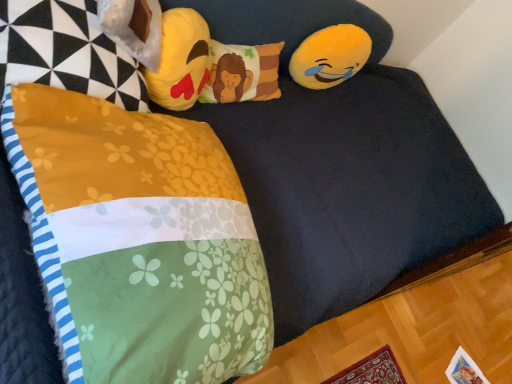
Locate an element on the screen. yellow plush emoji at upper right, which is the first toy in back-to-front order is located at coordinates 330,56.

This screenshot has width=512, height=384. What do you see at coordinates (209, 66) in the screenshot?
I see `soft yellow plush emoji at upper center, the second toy when ordered from back to front` at bounding box center [209, 66].

The height and width of the screenshot is (384, 512). I want to click on yellow plush emoji at upper right, which is the first toy in back-to-front order, so click(330, 56).

Does fluffy floral blanket at lower left, the 1th pillow when ordered from front to back, have a lesser width compared to yellow plush emoji at upper right, marked as the 2th toy in a left-to-right arrangement?

Incorrect, the width of fluffy floral blanket at lower left, the 1th pillow when ordered from front to back, is not less than that of yellow plush emoji at upper right, marked as the 2th toy in a left-to-right arrangement.

Is fluffy floral blanket at lower left, the second pillow when ordered from back to front, placed right next to yellow plush emoji at upper right, which is the 2th toy in front-to-back order?

No, fluffy floral blanket at lower left, the second pillow when ordered from back to front, is not next to yellow plush emoji at upper right, which is the 2th toy in front-to-back order.

Do you think fluffy floral blanket at lower left, the 1th pillow when ordered from front to back, is within yellow plush emoji at upper right, marked as the 2th toy in a left-to-right arrangement, or outside of it?

fluffy floral blanket at lower left, the 1th pillow when ordered from front to back, cannot be found inside yellow plush emoji at upper right, marked as the 2th toy in a left-to-right arrangement.

Which is less distant, (218, 234) or (332, 43)?

Positioned in front is point (218, 234).

Does soft yellow plush emoji at upper center, marked as the second toy in a right-to-left arrangement, turn towards fluffy floral blanket at lower left, marked as the second pillow in a top-to-bottom arrangement?

Yes, soft yellow plush emoji at upper center, marked as the second toy in a right-to-left arrangement, faces towards fluffy floral blanket at lower left, marked as the second pillow in a top-to-bottom arrangement.

Is soft yellow plush emoji at upper center, the first toy positioned from the left, beside fluffy floral blanket at lower left, the second pillow when ordered from back to front?

soft yellow plush emoji at upper center, the first toy positioned from the left, is not next to fluffy floral blanket at lower left, the second pillow when ordered from back to front, and they're not touching.

In the image, is soft yellow plush emoji at upper center, marked as the second toy in a right-to-left arrangement, on the left side or the right side of fluffy floral blanket at lower left, the 1th pillow when ordered from front to back?

soft yellow plush emoji at upper center, marked as the second toy in a right-to-left arrangement, is positioned on fluffy floral blanket at lower left, the 1th pillow when ordered from front to back,'s left side.

Does point (246, 95) come in front of point (125, 246)?

No, it is not.

In the image, is soft yellow plush emoji at upper center, the first toy positioned from the left, positioned in front of or behind yellow plush emoji at upper right, marked as the 2th toy in a left-to-right arrangement?

In the image, soft yellow plush emoji at upper center, the first toy positioned from the left, appears in front of yellow plush emoji at upper right, marked as the 2th toy in a left-to-right arrangement.

Is soft yellow plush emoji at upper center, the first toy positioned from the front, positioned beyond the bounds of yellow plush emoji at upper right, marked as the 2th toy in a left-to-right arrangement?

soft yellow plush emoji at upper center, the first toy positioned from the front, is positioned outside yellow plush emoji at upper right, marked as the 2th toy in a left-to-right arrangement.

Considering the positions of objects soft yellow plush emoji at upper center, marked as the second toy in a right-to-left arrangement, and yellow plush emoji at upper right, which is the 2th toy in front-to-back order, in the image provided, who is more to the right, soft yellow plush emoji at upper center, marked as the second toy in a right-to-left arrangement, or yellow plush emoji at upper right, which is the 2th toy in front-to-back order,?

yellow plush emoji at upper right, which is the 2th toy in front-to-back order, is more to the right.

From the image's perspective, is soft yellow plush emoji at upper center, the second toy when ordered from back to front, over yellow plush emoji at upper right, marked as the 2th toy in a left-to-right arrangement?

Actually, soft yellow plush emoji at upper center, the second toy when ordered from back to front, appears below yellow plush emoji at upper right, marked as the 2th toy in a left-to-right arrangement, in the image.

From the image's perspective, which is below, yellow plush emoji at upper right, which is the 2th toy in front-to-back order, or soft yellow plush emoji at upper center, marked as the second toy in a right-to-left arrangement?

soft yellow plush emoji at upper center, marked as the second toy in a right-to-left arrangement.

Considering the relative sizes of yellow plush emoji at upper right, the first toy positioned from the right, and soft yellow plush emoji at upper center, marked as the second toy in a right-to-left arrangement, in the image provided, is yellow plush emoji at upper right, the first toy positioned from the right, bigger than soft yellow plush emoji at upper center, marked as the second toy in a right-to-left arrangement,?

Incorrect, yellow plush emoji at upper right, the first toy positioned from the right, is not larger than soft yellow plush emoji at upper center, marked as the second toy in a right-to-left arrangement.

Is yellow plush emoji at upper right, which is the 2th toy in front-to-back order, next to soft yellow plush emoji at upper center, the first toy positioned from the front?

No, yellow plush emoji at upper right, which is the 2th toy in front-to-back order, is not next to soft yellow plush emoji at upper center, the first toy positioned from the front.

Where is `toy below the yellow plush emoji at upper right, marked as the 2th toy in a left-to-right arrangement (from the image's perspective)`? The width and height of the screenshot is (512, 384). toy below the yellow plush emoji at upper right, marked as the 2th toy in a left-to-right arrangement (from the image's perspective) is located at coordinates (209, 66).

Is fluffy floral blanket at lower left, which is counted as the 1th pillow, starting from the bottom, at the back of yellow plush emoji at upper right, which is the first toy in back-to-front order?

No, yellow plush emoji at upper right, which is the first toy in back-to-front order, is not facing away from fluffy floral blanket at lower left, which is counted as the 1th pillow, starting from the bottom.

From a real-world perspective, starting from the fluffy floral blanket at lower left, which is counted as the 1th pillow, starting from the bottom, which toy is the 2nd one below it? Please provide its 2D coordinates.

[(330, 56)]

Is yellow plush emoji at upper right, which is the first toy in back-to-front order, positioned behind fluffy floral blanket at lower left, the 1th pillow when ordered from front to back?

Yes, yellow plush emoji at upper right, which is the first toy in back-to-front order, is behind fluffy floral blanket at lower left, the 1th pillow when ordered from front to back.

Is floral fabric pillow at center, the 2th pillow ordered from the bottom, smaller than yellow plush emoji at upper right, which is the first toy in back-to-front order?

Actually, floral fabric pillow at center, the 2th pillow ordered from the bottom, might be larger than yellow plush emoji at upper right, which is the first toy in back-to-front order.

Measure the distance from floral fabric pillow at center, the 2th pillow ordered from the bottom, to yellow plush emoji at upper right, marked as the 2th toy in a left-to-right arrangement.

The distance of floral fabric pillow at center, the 2th pillow ordered from the bottom, from yellow plush emoji at upper right, marked as the 2th toy in a left-to-right arrangement, is 9.15 inches.

From the image's perspective, would you say floral fabric pillow at center, the 2th pillow ordered from the bottom, is positioned over yellow plush emoji at upper right, marked as the 2th toy in a left-to-right arrangement?

No, from the image's perspective, floral fabric pillow at center, the 2th pillow ordered from the bottom, is not above yellow plush emoji at upper right, marked as the 2th toy in a left-to-right arrangement.

Considering the positions of point (278, 43) and point (227, 92), is point (278, 43) closer or farther from the camera than point (227, 92)?

Point (278, 43) is farther from the camera than point (227, 92).

Looking at this image, between soft yellow plush emoji at upper center, the first toy positioned from the front, and floral fabric pillow at center, the 2th pillow ordered from the bottom, which one is positioned behind?

floral fabric pillow at center, the 2th pillow ordered from the bottom, is further from the camera.

Is soft yellow plush emoji at upper center, the second toy when ordered from back to front, far from floral fabric pillow at center, which ranks as the 1th pillow in top-to-bottom order?

soft yellow plush emoji at upper center, the second toy when ordered from back to front, is near floral fabric pillow at center, which ranks as the 1th pillow in top-to-bottom order, not far away.

Consider the image. From the image's perspective, is soft yellow plush emoji at upper center, the first toy positioned from the left, over floral fabric pillow at center, the 2th pillow ordered from the bottom?

No, from the image's perspective, soft yellow plush emoji at upper center, the first toy positioned from the left, is not above floral fabric pillow at center, the 2th pillow ordered from the bottom.

Where is `toy on the right of the fluffy floral blanket at lower left, marked as the second pillow in a top-to-bottom arrangement`? The height and width of the screenshot is (384, 512). toy on the right of the fluffy floral blanket at lower left, marked as the second pillow in a top-to-bottom arrangement is located at coordinates (330, 56).

Identify the location of pillow lying in front of the soft yellow plush emoji at upper center, the first toy positioned from the left. (139, 240).

When comparing their distances from soft yellow plush emoji at upper center, the first toy positioned from the front, does fluffy floral blanket at lower left, marked as the second pillow in a top-to-bottom arrangement, or floral fabric pillow at center, acting as the 2th pillow starting from the front, seem closer?

The object closer to soft yellow plush emoji at upper center, the first toy positioned from the front, is floral fabric pillow at center, acting as the 2th pillow starting from the front.

From the image, which object appears to be nearer to fluffy floral blanket at lower left, the 1th pillow when ordered from front to back, soft yellow plush emoji at upper center, the second toy when ordered from back to front, or yellow plush emoji at upper right, which is the first toy in back-to-front order?

Based on the image, soft yellow plush emoji at upper center, the second toy when ordered from back to front, appears to be nearer to fluffy floral blanket at lower left, the 1th pillow when ordered from front to back.

Based on their spatial positions, is yellow plush emoji at upper right, which is the first toy in back-to-front order, or fluffy floral blanket at lower left, the second pillow when ordered from back to front, closer to soft yellow plush emoji at upper center, the first toy positioned from the left?

yellow plush emoji at upper right, which is the first toy in back-to-front order, is positioned closer to the anchor soft yellow plush emoji at upper center, the first toy positioned from the left.

Considering their positions, is yellow plush emoji at upper right, which is the 2th toy in front-to-back order, positioned closer to floral fabric pillow at center, acting as the 2th pillow starting from the front, than soft yellow plush emoji at upper center, marked as the second toy in a right-to-left arrangement?

Among the two, soft yellow plush emoji at upper center, marked as the second toy in a right-to-left arrangement, is located nearer to floral fabric pillow at center, acting as the 2th pillow starting from the front.

Based on their spatial positions, is floral fabric pillow at center, the 2th pillow ordered from the bottom, or yellow plush emoji at upper right, which is the first toy in back-to-front order, closer to soft yellow plush emoji at upper center, marked as the second toy in a right-to-left arrangement?

Among the two, floral fabric pillow at center, the 2th pillow ordered from the bottom, is located nearer to soft yellow plush emoji at upper center, marked as the second toy in a right-to-left arrangement.

Looking at the image, which one is located closer to fluffy floral blanket at lower left, which is counted as the 1th pillow, starting from the bottom, yellow plush emoji at upper right, which is the first toy in back-to-front order, or floral fabric pillow at center, acting as the 2th pillow starting from the front?

floral fabric pillow at center, acting as the 2th pillow starting from the front, lies closer to fluffy floral blanket at lower left, which is counted as the 1th pillow, starting from the bottom, than the other object.

Estimate the real-world distances between objects in this image. Which object is further from floral fabric pillow at center, the 2th pillow ordered from the bottom, soft yellow plush emoji at upper center, marked as the second toy in a right-to-left arrangement, or yellow plush emoji at upper right, marked as the 2th toy in a left-to-right arrangement?

The object further to floral fabric pillow at center, the 2th pillow ordered from the bottom, is yellow plush emoji at upper right, marked as the 2th toy in a left-to-right arrangement.

Based on the photo, from the image, which object appears to be nearer to fluffy floral blanket at lower left, which is counted as the 1th pillow, starting from the bottom, soft yellow plush emoji at upper center, marked as the second toy in a right-to-left arrangement, or floral fabric pillow at center, the 2th pillow ordered from the bottom?

Among the two, soft yellow plush emoji at upper center, marked as the second toy in a right-to-left arrangement, is located nearer to fluffy floral blanket at lower left, which is counted as the 1th pillow, starting from the bottom.

Find the location of a particular element. The height and width of the screenshot is (384, 512). pillow between fluffy floral blanket at lower left, the 1th pillow when ordered from front to back, and yellow plush emoji at upper right, the first toy positioned from the right, along the z-axis is located at coordinates (242, 73).

Where is `toy positioned between fluffy floral blanket at lower left, the second pillow when ordered from back to front, and yellow plush emoji at upper right, which is the 2th toy in front-to-back order, from near to far`? toy positioned between fluffy floral blanket at lower left, the second pillow when ordered from back to front, and yellow plush emoji at upper right, which is the 2th toy in front-to-back order, from near to far is located at coordinates pos(209,66).

Image resolution: width=512 pixels, height=384 pixels. I want to click on toy between fluffy floral blanket at lower left, the 1th pillow when ordered from front to back, and floral fabric pillow at center, acting as the 2th pillow starting from the front, from front to back, so click(209, 66).